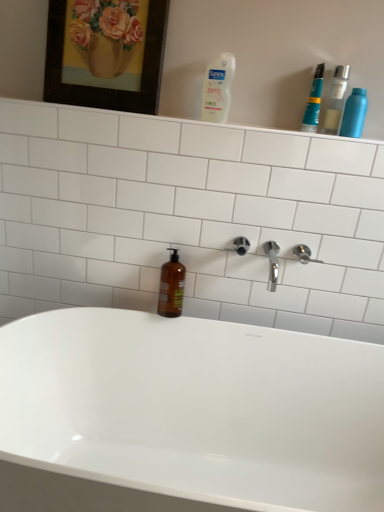
Where is `free location to the left of transparent plastic bottle at upper right, the third mouthwash positioned from the left`? The image size is (384, 512). free location to the left of transparent plastic bottle at upper right, the third mouthwash positioned from the left is located at coordinates (283, 128).